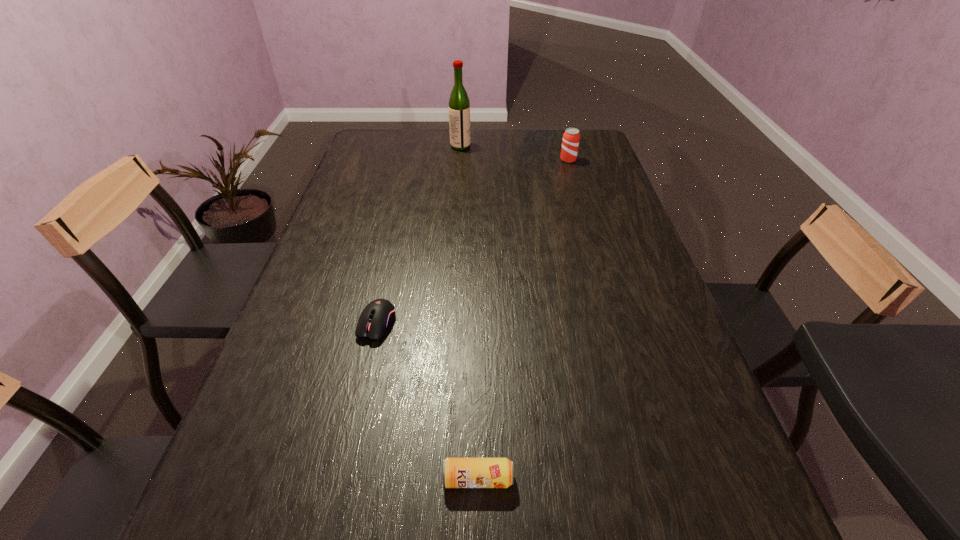
The image size is (960, 540). Find the location of `the farthest object`. the farthest object is located at coordinates (459, 105).

I want to click on liquor, so click(x=459, y=105).

The image size is (960, 540). In order to click on the right beer can in this screenshot , I will do `click(570, 143)`.

The width and height of the screenshot is (960, 540). In order to click on the third nearest object in this screenshot , I will do [x=570, y=143].

The image size is (960, 540). What are the coordinates of `computer mouse` in the screenshot? It's located at (379, 315).

Find the location of a particular element. The width and height of the screenshot is (960, 540). the third farthest object is located at coordinates (379, 315).

The height and width of the screenshot is (540, 960). What are the coordinates of `the nearest object` in the screenshot? It's located at (456, 472).

Where is `the shorter beer can`? Image resolution: width=960 pixels, height=540 pixels. the shorter beer can is located at coordinates (456, 472).

Find the location of a particular element. vacant area situated on the label of the liquor is located at coordinates (550, 146).

Find the location of a particular element. The width and height of the screenshot is (960, 540). vacant space located on the front of the taller beer can is located at coordinates (576, 185).